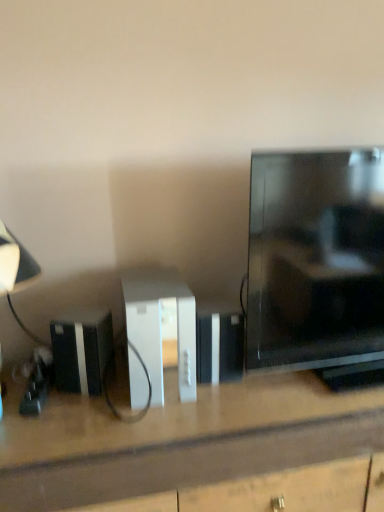
You are a GUI agent. You are given a task and a screenshot of the screen. Output one action in this format:
    pyautogui.click(x=<x>, y=<y>)
    Task: Click on the spots to the right of matte black lampshade at left
    
    Given the screenshot: What is the action you would take?
    pyautogui.click(x=92, y=413)